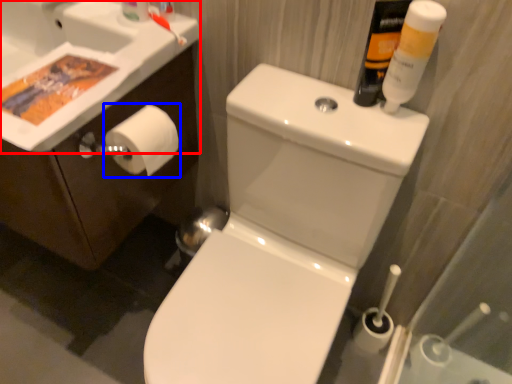
Question: Which of the following is the closest to the observer, sink (highlighted by a red box) or toilet paper (highlighted by a blue box)?

Choices:
 (A) sink
 (B) toilet paper

Answer: (A)